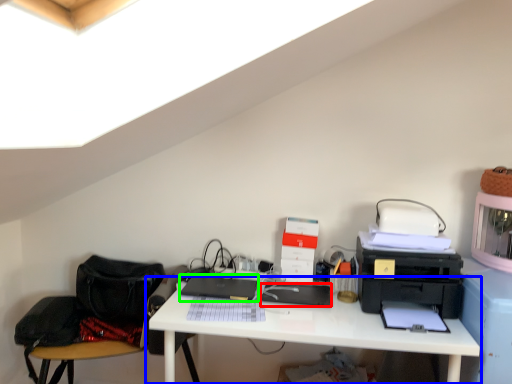
Question: Which object is positioned closest to register (highlighted by a red box)? Select from desk (highlighted by a blue box) and laptop (highlighted by a green box).

Choices:
 (A) desk
 (B) laptop

Answer: (A)